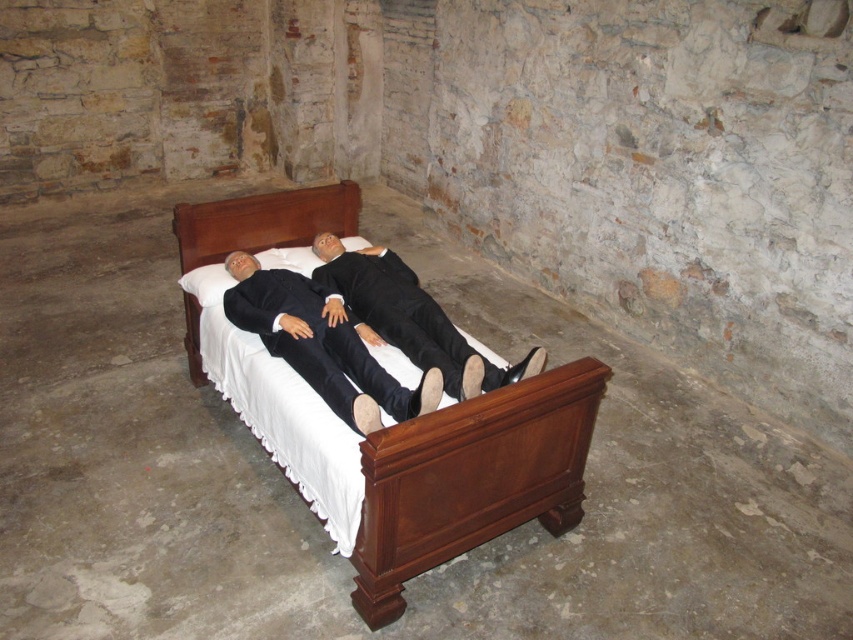
Based on the photo, does mahogany wood bed at center have a larger size compared to black matte business suit at center?

Indeed, mahogany wood bed at center has a larger size compared to black matte business suit at center.

Measure the distance between mahogany wood bed at center and camera.

mahogany wood bed at center and camera are 6.67 feet apart from each other.

Is point (409, 444) positioned behind point (264, 296)?

No, it is in front of (264, 296).

Locate an element on the screen. This screenshot has height=640, width=853. mahogany wood bed at center is located at coordinates (473, 481).

Looking at this image, can you confirm if black matte suit at center is positioned above brown wood headboard at center?

Incorrect, black matte suit at center is not positioned above brown wood headboard at center.

Between black matte suit at center and brown wood headboard at center, which one has more height?

black matte suit at center

Image resolution: width=853 pixels, height=640 pixels. What are the coordinates of `black matte suit at center` in the screenshot? It's located at (410, 317).

Does black matte business suit at center have a lesser height compared to black matte suit at center?

Indeed, black matte business suit at center has a lesser height compared to black matte suit at center.

Can you confirm if black matte business suit at center is wider than black matte suit at center?

No, black matte business suit at center is not wider than black matte suit at center.

The height and width of the screenshot is (640, 853). Find the location of `black matte business suit at center`. black matte business suit at center is located at coordinates (315, 342).